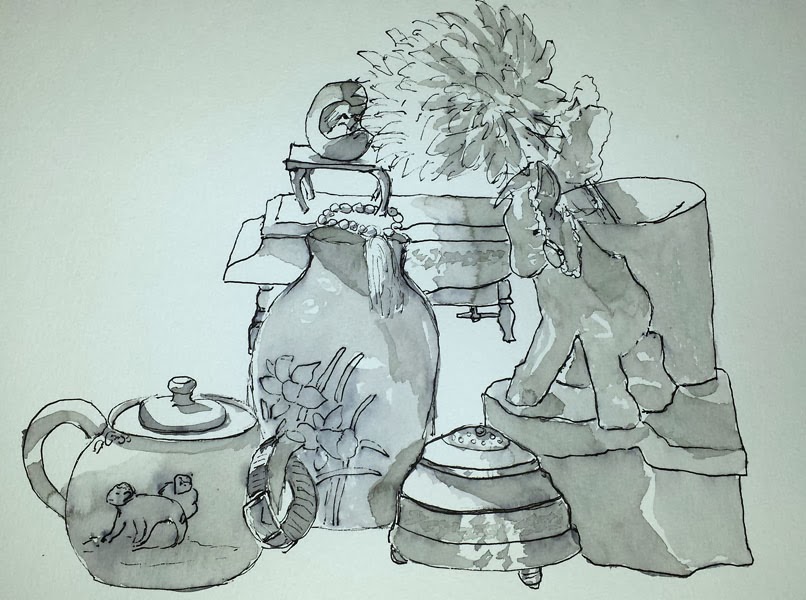
Image resolution: width=806 pixels, height=600 pixels. I want to click on teapot handle, so click(31, 444).